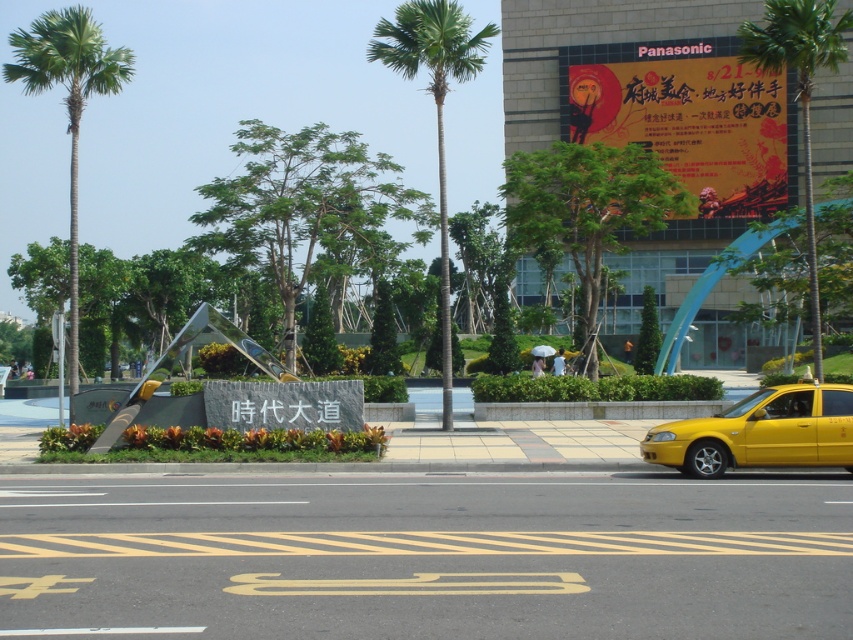
Question: Estimate the real-world distances between objects in this image. Which object is closer to the green leafy palm tree at upper right?

Choices:
 (A) green leafy palm tree at left
 (B) matte plastic billboard at upper center
 (C) yellow matte taxi at lower right

Answer: (C)

Question: Considering the relative positions of yellow matte taxi at lower right and green leafy palm tree at upper right in the image provided, where is yellow matte taxi at lower right located with respect to green leafy palm tree at upper right?

Choices:
 (A) right
 (B) left

Answer: (B)

Question: Does matte plastic billboard at upper center lie in front of green leafy palm tree at upper right?

Choices:
 (A) yes
 (B) no

Answer: (B)

Question: Which point is farther to the camera?

Choices:
 (A) matte plastic billboard at upper center
 (B) green leafy palm tree at center
 (C) yellow matte taxi at lower right

Answer: (A)

Question: Among these objects, which one is farthest from the camera?

Choices:
 (A) green leafy palm tree at center
 (B) green leafy palm tree at left
 (C) matte plastic billboard at upper center
 (D) green leafy palm tree at upper right

Answer: (C)

Question: Is yellow matte taxi at lower right to the right of green leafy palm tree at center from the viewer's perspective?

Choices:
 (A) yes
 (B) no

Answer: (A)